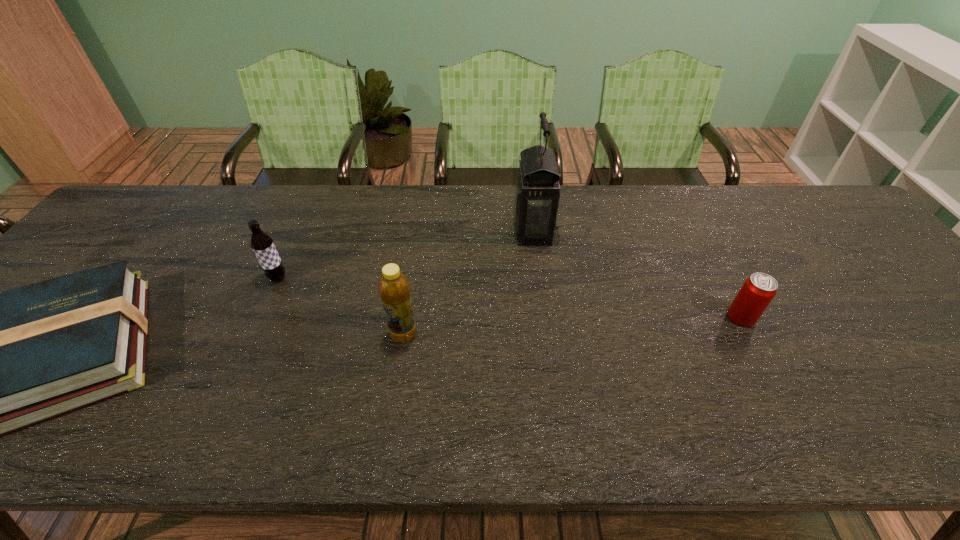
Where is `the fourth object from left to right`? the fourth object from left to right is located at coordinates (537, 191).

The image size is (960, 540). In order to click on the tallest object in this screenshot , I will do `click(537, 191)`.

I want to click on the third object from left to right, so click(394, 289).

Where is `the fourth object from right to left`? The image size is (960, 540). the fourth object from right to left is located at coordinates (262, 244).

Find the location of a particular element. This screenshot has width=960, height=540. root beer is located at coordinates (262, 244).

You are a GUI agent. You are given a task and a screenshot of the screen. Output one action in this format:
    pyautogui.click(x=<x>, y=<y>)
    Task: Click on the fourth tallest object
    
    Given the screenshot: What is the action you would take?
    pyautogui.click(x=759, y=289)

Identify the location of the rightmost object. (759, 289).

Find the location of a particular element. The height and width of the screenshot is (540, 960). vacant position located 0.280m on the front-facing side of the tallest object is located at coordinates (417, 231).

This screenshot has height=540, width=960. I want to click on vacant space located on the front-facing side of the tallest object, so click(x=458, y=231).

Image resolution: width=960 pixels, height=540 pixels. What are the coordinates of `blank space located 0.200m on the front-facing side of the tallest object` in the screenshot? It's located at [444, 231].